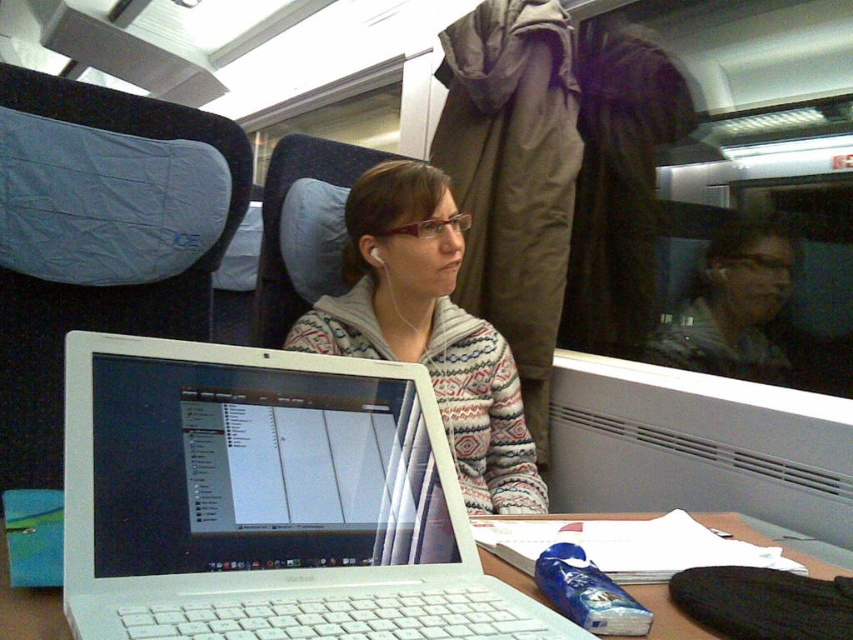
Does white sweater at center appear over white plastic table at center?

Indeed, white sweater at center is positioned over white plastic table at center.

Does white sweater at center lie behind white plastic table at center?

Yes, white sweater at center is behind white plastic table at center.

Where is `white sweater at center`? The image size is (853, 640). white sweater at center is located at coordinates (428, 328).

What are the coordinates of `white sweater at center` in the screenshot? It's located at (428, 328).

Is white plastic laptop at center to the right of striped sweater at center from the viewer's perspective?

No, white plastic laptop at center is not to the right of striped sweater at center.

The width and height of the screenshot is (853, 640). Describe the element at coordinates (267, 500) in the screenshot. I see `white plastic laptop at center` at that location.

At what (x,y) coordinates should I click in order to perform the action: click on white plastic laptop at center. Please return your answer as a coordinate pair (x, y). This screenshot has width=853, height=640. Looking at the image, I should click on (267, 500).

I want to click on white plastic table at center, so click(27, 608).

Can you confirm if white plastic table at center is bigger than white earphone at center?

Indeed, white plastic table at center has a larger size compared to white earphone at center.

Is point (10, 630) less distant than point (370, 248)?

That is True.

This screenshot has width=853, height=640. What are the coordinates of `white plastic table at center` in the screenshot? It's located at (27, 608).